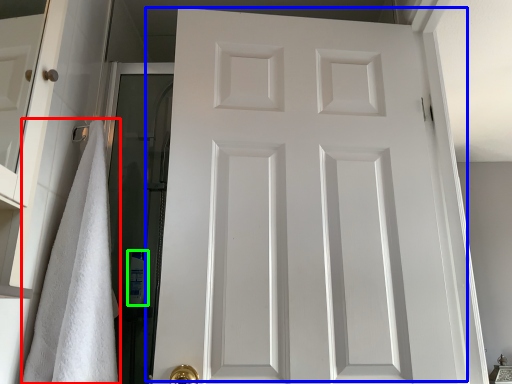
Question: Which object is positioned farthest from bath towel (highlighted by a red box)? Select from door (highlighted by a blue box) and toiletry (highlighted by a green box).

Choices:
 (A) door
 (B) toiletry

Answer: (B)